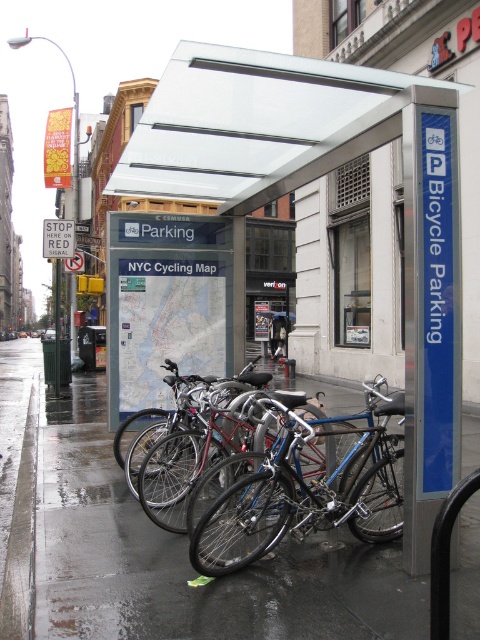
Question: From the image, what is the correct spatial relationship of metallic bicycle parking at center in relation to shiny blue bike at center?

Choices:
 (A) above
 (B) below

Answer: (A)

Question: Considering the real-world distances, which object is closest to the transparent plastic canopy at upper center?

Choices:
 (A) metallic bicycle at center
 (B) shiny blue bike at center

Answer: (B)

Question: Which point is farther to the camera?

Choices:
 (A) wet asphalt at lower center
 (B) metallic bicycle parking at center

Answer: (B)

Question: Which of these objects is positioned closest to the wet asphalt at lower center?

Choices:
 (A) metallic bicycle at center
 (B) shiny blue bike at center
 (C) transparent plastic canopy at upper center
 (D) metallic bicycle parking at center

Answer: (B)

Question: Does shiny blue bike at center have a greater width compared to metallic bicycle at center?

Choices:
 (A) no
 (B) yes

Answer: (B)

Question: Considering the relative positions of wet asphalt at lower center and transparent plastic canopy at upper center in the image provided, where is wet asphalt at lower center located with respect to transparent plastic canopy at upper center?

Choices:
 (A) right
 (B) left

Answer: (A)